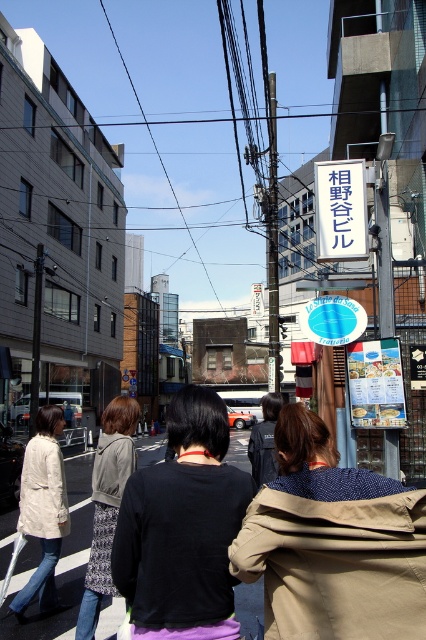
You are a delivery person carrying a box that is 1.2 meters wide. You need to pass through the space between the tan fabric jacket at center and the black fabric shirt at center. Can your box fit through the space between them?

The tan fabric jacket at center is wider than the black fabric shirt at center, but the exact width of the space between them isn not specified. Without knowing the distance between the two, it is impossible to determine if the 1.2 meter wide box can fit through the space.

You are standing on the sidewalk and want to hand a flyer to the person wearing the tan fabric jacket at center and the light beige jacket at lower left. If you can reach up to 10 feet, which person can you reach first without moving?

The light beige jacket at lower left is closer to you than the tan fabric jacket at center, so you can reach the light beige jacket at lower left first without moving.